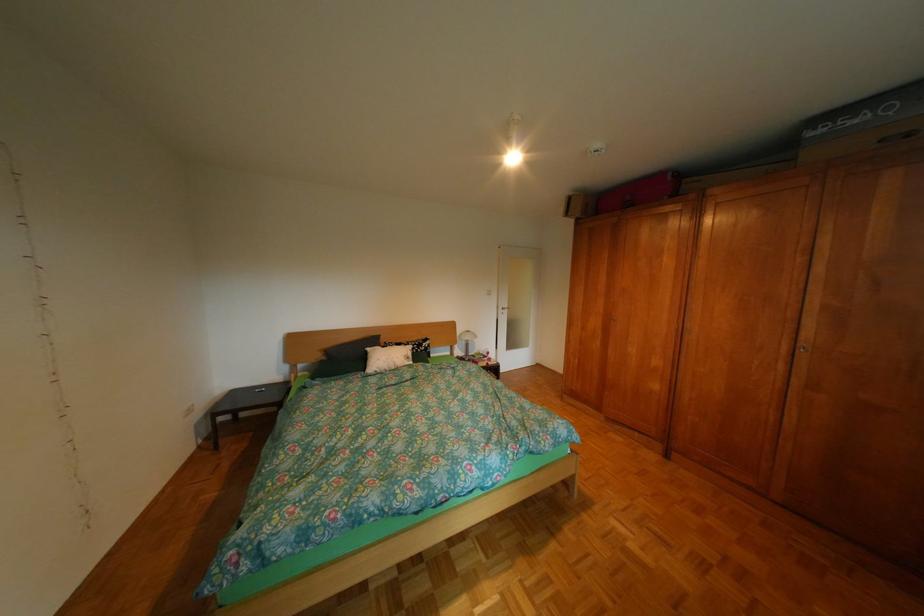
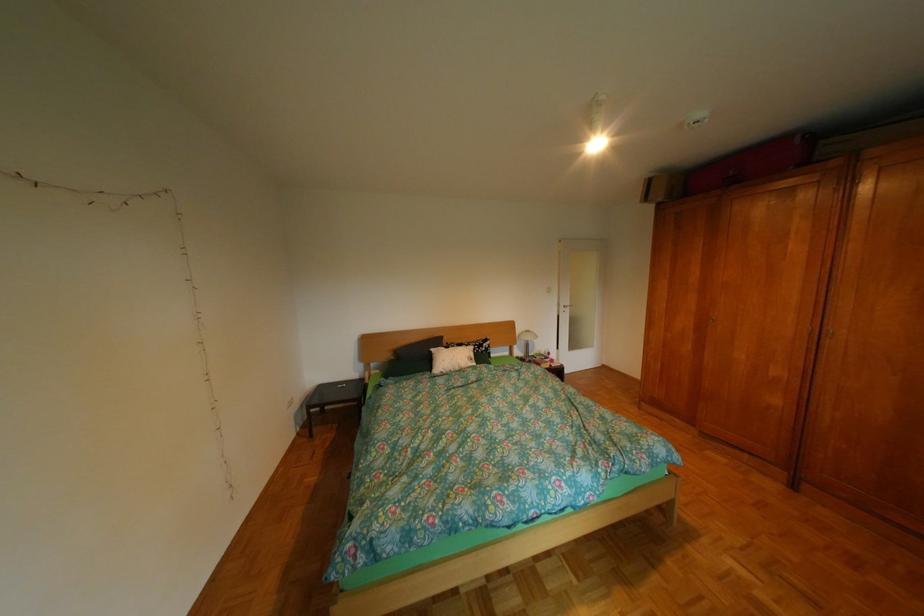
Find the pixel in the second image that matches point 338,359 in the first image.

(407, 359)